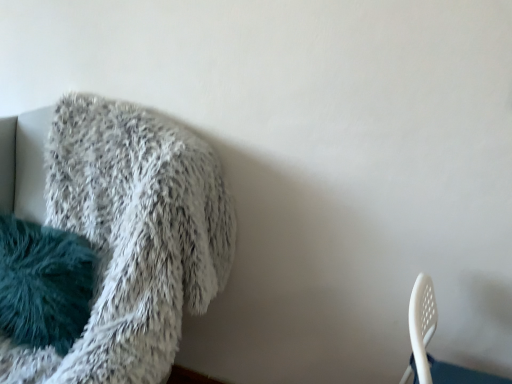
This screenshot has width=512, height=384. What do you see at coordinates (131, 238) in the screenshot?
I see `white fluffy towel at upper left` at bounding box center [131, 238].

In order to click on white fluffy towel at upper left in this screenshot , I will do `click(131, 238)`.

What are the coordinates of `white fluffy towel at upper left` in the screenshot? It's located at (131, 238).